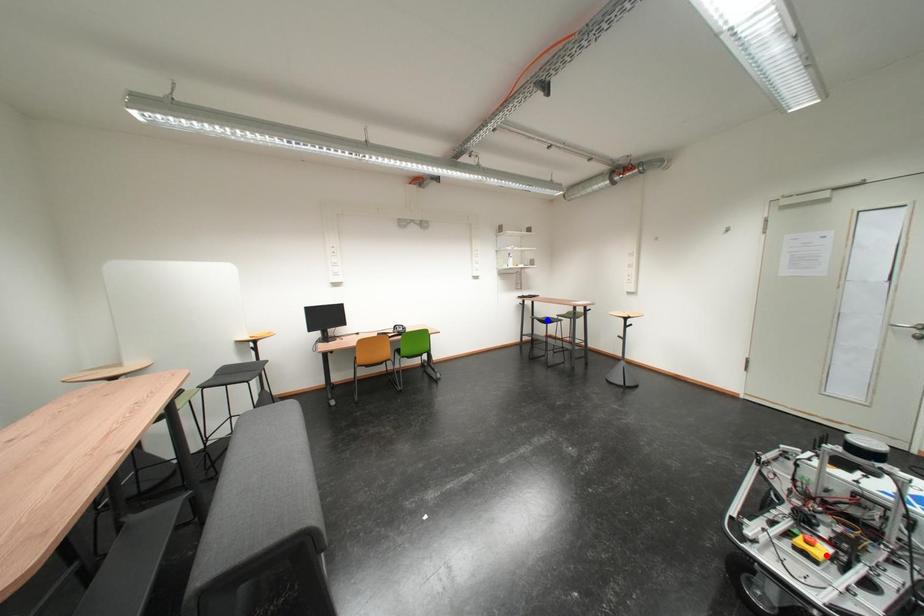
Question: Which of the two points in the image is closer to the camera?

Choices:
 (A) Blue point is closer.
 (B) Red point is closer.

Answer: (B)